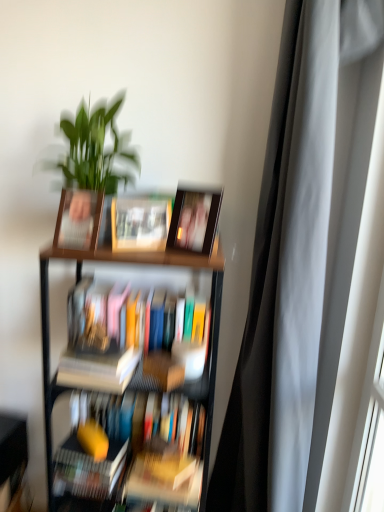
Question: In which direction should I rotate to look at matte wooden photo frame at center, which is the 4th book in bottom-to-top order?

Choices:
 (A) right
 (B) left

Answer: (B)

Question: Would you consider wooden bookshelf at lower left to be distant from matte plastic picture frame at upper left, marked as the 1th picture frame in a left-to-right arrangement?

Choices:
 (A) yes
 (B) no

Answer: (A)

Question: Can you confirm if wooden bookshelf at lower left is smaller than matte plastic picture frame at upper left, which is counted as the 2th picture frame, starting from the right?

Choices:
 (A) yes
 (B) no

Answer: (B)

Question: Is wooden bookshelf at lower left facing towards matte plastic picture frame at upper left, marked as the 1th picture frame in a left-to-right arrangement?

Choices:
 (A) yes
 (B) no

Answer: (B)

Question: From the image's perspective, is wooden bookshelf at lower left on matte plastic picture frame at upper left, which is counted as the 2th picture frame, starting from the right?

Choices:
 (A) yes
 (B) no

Answer: (B)

Question: From a real-world perspective, is wooden bookshelf at lower left positioned over matte plastic picture frame at upper left, marked as the 1th picture frame in a left-to-right arrangement, based on gravity?

Choices:
 (A) yes
 (B) no

Answer: (B)

Question: Is wooden bookshelf at lower left taller than matte plastic picture frame at upper left, marked as the 1th picture frame in a left-to-right arrangement?

Choices:
 (A) yes
 (B) no

Answer: (B)

Question: From a real-world perspective, is wooden bookcase at center over hardcover book at lower left, acting as the 1th book starting from the bottom?

Choices:
 (A) no
 (B) yes

Answer: (B)

Question: From the image's perspective, is wooden bookcase at center above hardcover book at lower left, the 4th book from the top?

Choices:
 (A) yes
 (B) no

Answer: (A)

Question: From a real-world perspective, is wooden bookcase at center located beneath hardcover book at lower left, the 4th book from the top?

Choices:
 (A) no
 (B) yes

Answer: (A)

Question: Is wooden bookcase at center bigger than hardcover book at lower left, the 4th book from the top?

Choices:
 (A) yes
 (B) no

Answer: (A)

Question: Is wooden bookcase at center outside hardcover book at lower left, the 4th book from the top?

Choices:
 (A) yes
 (B) no

Answer: (A)

Question: Is wooden bookcase at center further to the viewer compared to hardcover book at lower left, acting as the 1th book starting from the bottom?

Choices:
 (A) yes
 (B) no

Answer: (B)

Question: Does hardcover book at lower left, the 4th book from the top, turn towards wooden bookshelf at lower left?

Choices:
 (A) no
 (B) yes

Answer: (A)